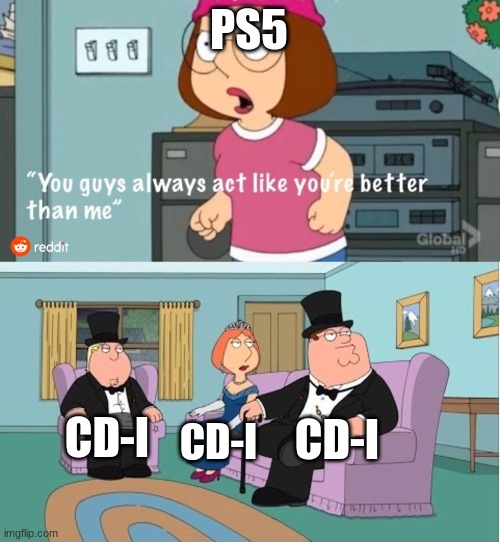
Identify the location of curtain. (183, 359).